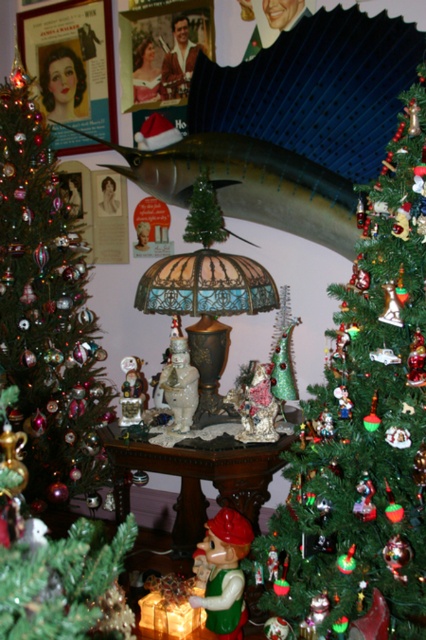
You are organizing a Christmas display and need to place a new ornament between the green matte figurine at lower center and the porcelain snowman at center. According to the current arrangement, which side of the porcelain snowman should the new ornament be placed on?

The green matte figurine at lower center is positioned on the right side of the porcelain snowman at center, so the new ornament should be placed to the left of the porcelain snowman at center to maintain the arrangement.

Based on the photo, you are standing in the festive indoor setting and want to reach a gift placed at point (80, 442). If your maximum reach is 2 meters, can you grab it without moving closer?

The distance between you and point (80, 442) is 2.54 meters, which is beyond your 2 meter reach. You need to move closer to grab the gift.

You are a guest at a Christmas party standing in front of the shiny green christmas tree at left. You want to see the porcelain snowman at center. Can you see it without moving your position?

The porcelain snowman at center is behind the shiny green christmas tree at left, so you cannot see it from your current position in front of the shiny green christmas tree at left.